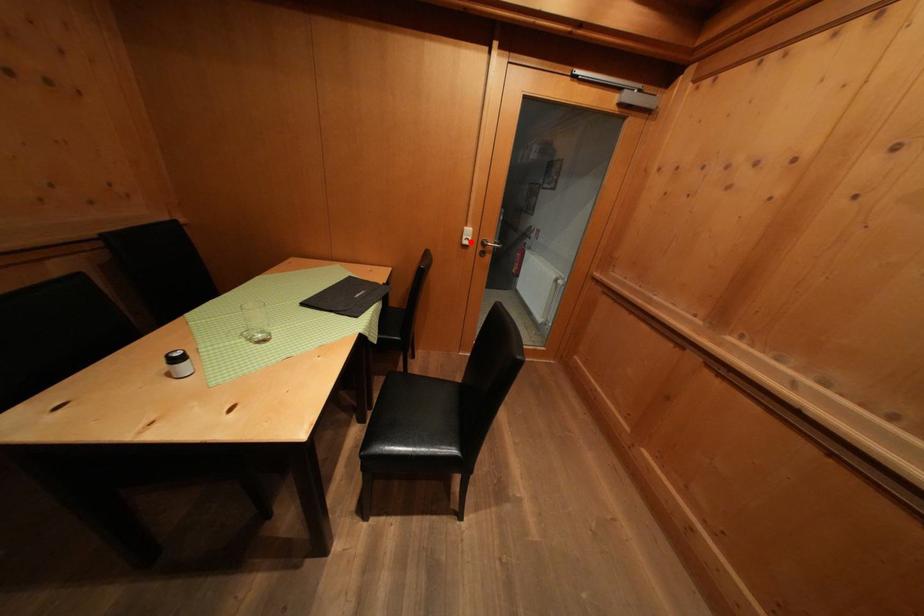
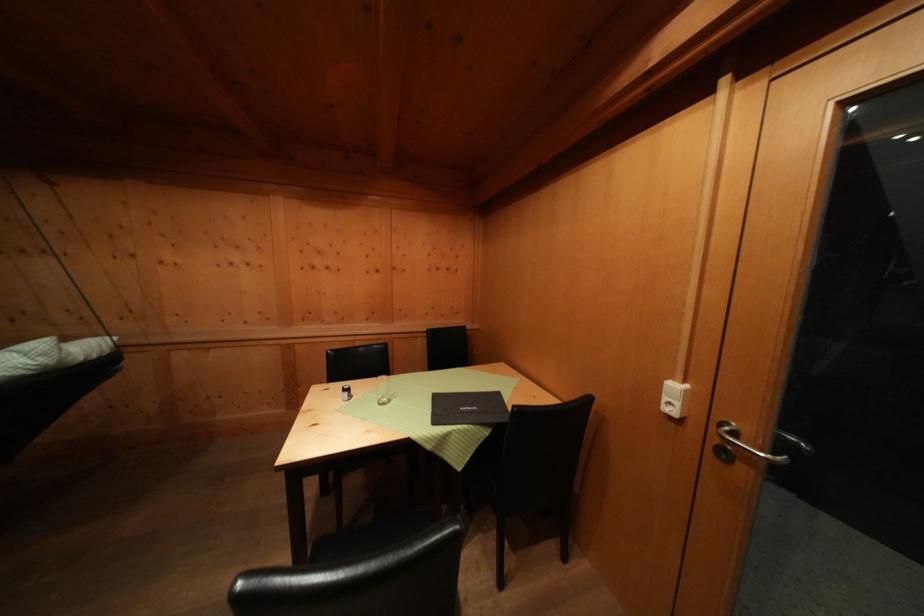
Where in the second image is the point corresponding to the highlighted location from the first image?

(672, 403)